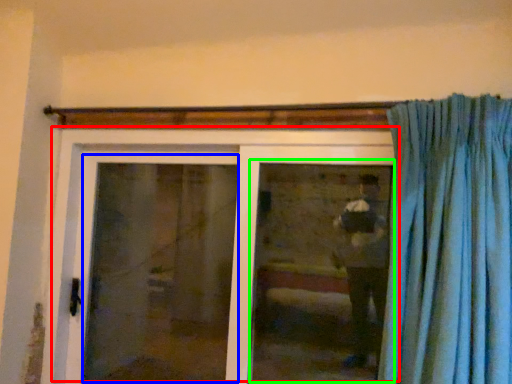
Question: Which is farther away from door (highlighted by a red box)? screen door (highlighted by a blue box) or window (highlighted by a green box)?

Choices:
 (A) screen door
 (B) window

Answer: (B)